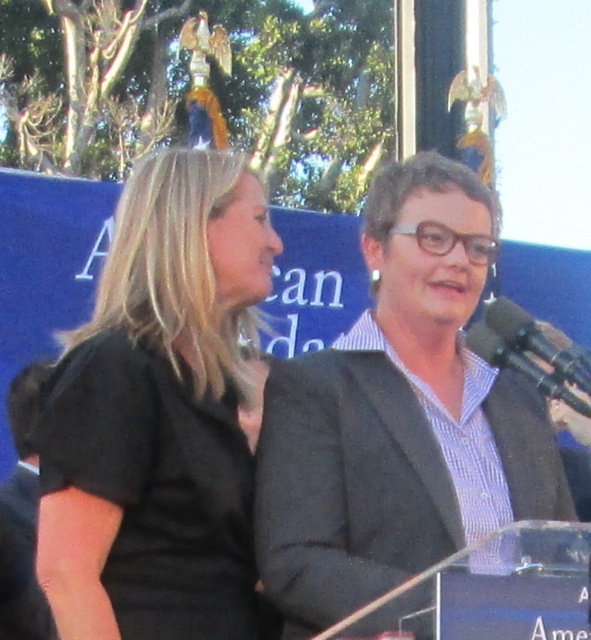
Is black matte shirt at center wider than black plastic microphone at right?

Indeed, black matte shirt at center has a greater width compared to black plastic microphone at right.

Between black matte shirt at center and black plastic microphone at right, which one has less height?

black plastic microphone at right is shorter.

The image size is (591, 640). What do you see at coordinates (160, 416) in the screenshot?
I see `black matte shirt at center` at bounding box center [160, 416].

What are the coordinates of `black matte shirt at center` in the screenshot? It's located at (160, 416).

The height and width of the screenshot is (640, 591). What do you see at coordinates (160, 416) in the screenshot?
I see `black matte shirt at center` at bounding box center [160, 416].

Measure the distance from black matte shirt at center to matte gray blazer at center.

14.02 feet

Locate an element on the screen. The width and height of the screenshot is (591, 640). black matte shirt at center is located at coordinates (160, 416).

Does matte gray blazer at center have a larger size compared to black plastic microphone at right?

Indeed, matte gray blazer at center has a larger size compared to black plastic microphone at right.

At what (x,y) coordinates should I click in order to perform the action: click on matte gray blazer at center. Please return your answer as a coordinate pair (x, y). This screenshot has width=591, height=640. Looking at the image, I should click on [x=400, y=416].

Is point (388, 220) less distant than point (586, 387)?

No, (388, 220) is behind (586, 387).

This screenshot has height=640, width=591. In order to click on matte gray blazer at center in this screenshot , I will do `click(400, 416)`.